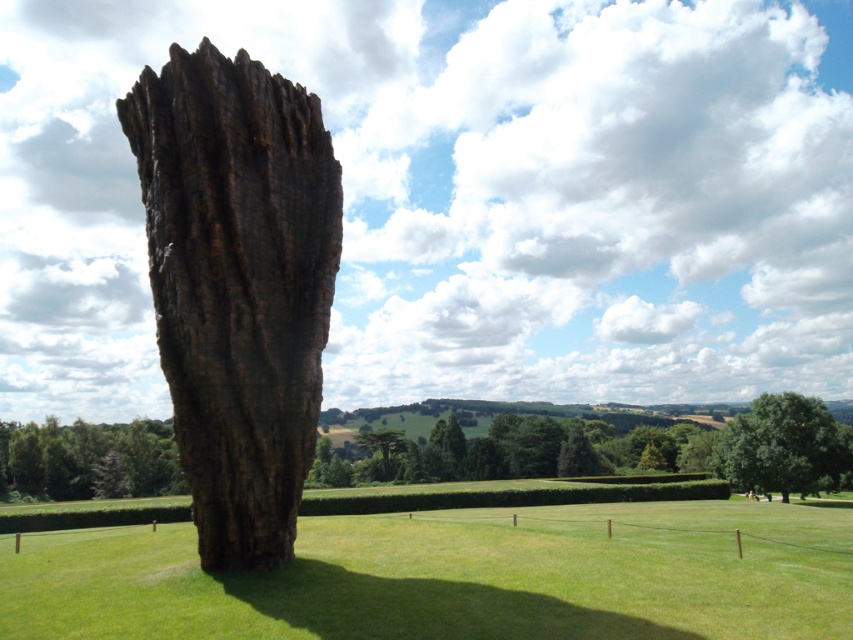
Is green grass at center to the left of rustic wood sculpture at center from the viewer's perspective?

In fact, green grass at center is to the right of rustic wood sculpture at center.

Based on the photo, which of these two, green grass at center or rustic wood sculpture at center, stands taller?

With more height is rustic wood sculpture at center.

The height and width of the screenshot is (640, 853). Describe the element at coordinates (456, 577) in the screenshot. I see `green grass at center` at that location.

This screenshot has height=640, width=853. I want to click on green grass at center, so click(x=456, y=577).

Does rustic wood sculpture at center appear over green leafy tree at center?

Yes, rustic wood sculpture at center is above green leafy tree at center.

Identify the location of rustic wood sculpture at center. The height and width of the screenshot is (640, 853). (236, 285).

Is point (152, 109) in front of point (772, 445)?

Yes, it is in front of point (772, 445).

Locate an element on the screen. The image size is (853, 640). rustic wood sculpture at center is located at coordinates (236, 285).

Does dark brown textured tree trunk at lower left appear on the left side of green leafy tree at center?

Yes, dark brown textured tree trunk at lower left is to the left of green leafy tree at center.

Is dark brown textured tree trunk at lower left wider than green leafy tree at center?

Correct, the width of dark brown textured tree trunk at lower left exceeds that of green leafy tree at center.

Locate an element on the screen. dark brown textured tree trunk at lower left is located at coordinates [88, 460].